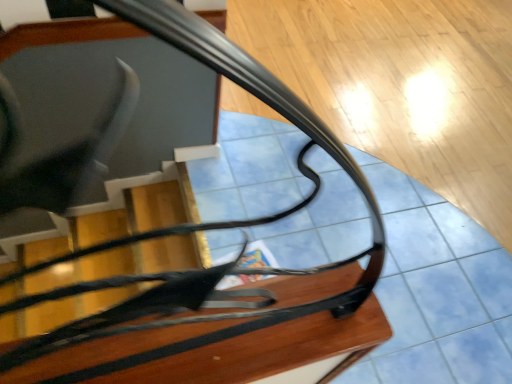
Locate an element on the screen. free space above wooden table at center (from a real-world perspective) is located at coordinates (216, 344).